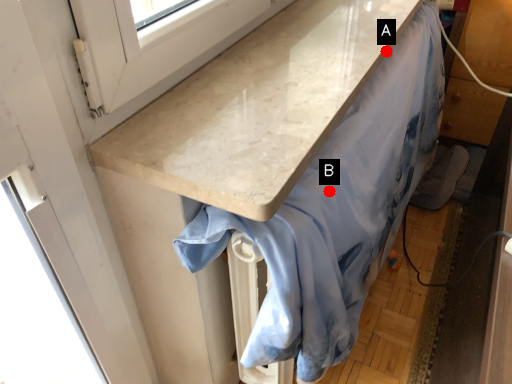
Question: Two points are circled on the image, labeled by A and B beside each circle. Which point is closer to the camera taking this photo?

Choices:
 (A) A is closer
 (B) B is closer

Answer: (B)